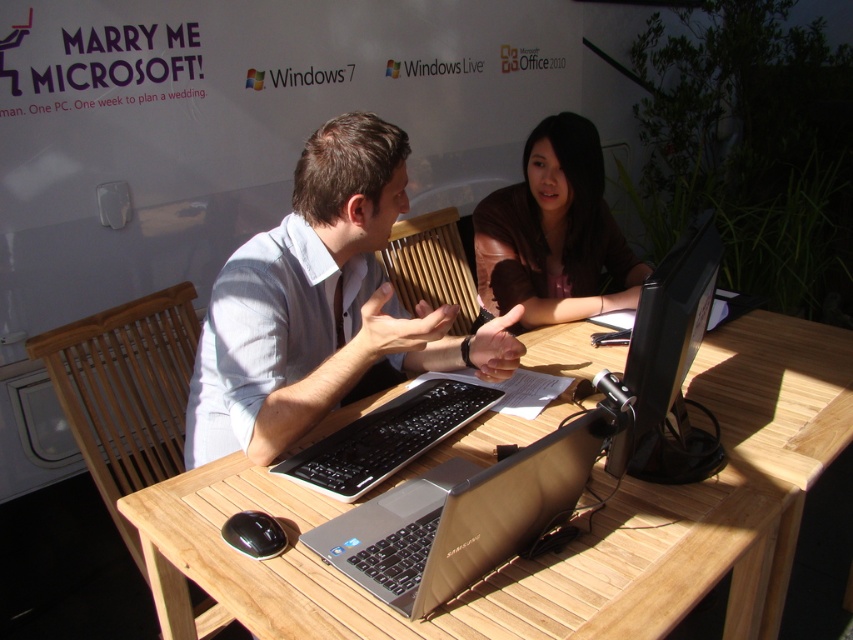
Question: Is light blue shirt at center wider than silver metallic laptop at center?

Choices:
 (A) yes
 (B) no

Answer: (A)

Question: Which point is farther to the camera?

Choices:
 (A) wooden table at center
 (B) silver metallic laptop at center
 (C) brown leather jacket at upper center
 (D) light blue shirt at center

Answer: (C)

Question: Among these objects, which one is nearest to the camera?

Choices:
 (A) silver metallic laptop at center
 (B) brown leather jacket at upper center
 (C) wooden table at center

Answer: (A)

Question: Can you confirm if silver metallic laptop at center is positioned to the right of black glossy monitor at center?

Choices:
 (A) yes
 (B) no

Answer: (B)

Question: Which of the following is the farthest from the observer?

Choices:
 (A) (508, 467)
 (B) (413, 333)

Answer: (B)

Question: Does black glossy monitor at center have a lesser width compared to black glossy mouse at lower left?

Choices:
 (A) no
 (B) yes

Answer: (A)